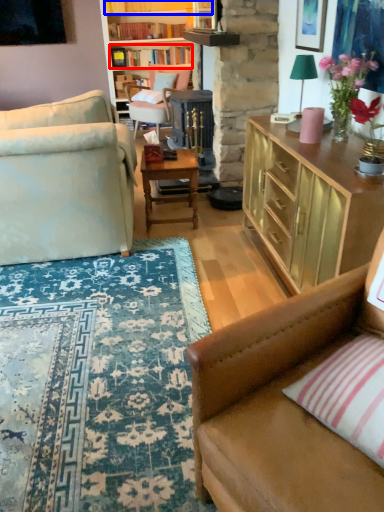
Question: Which object is closer to the camera taking this photo, book (highlighted by a red box) or book (highlighted by a blue box)?

Choices:
 (A) book
 (B) book

Answer: (B)